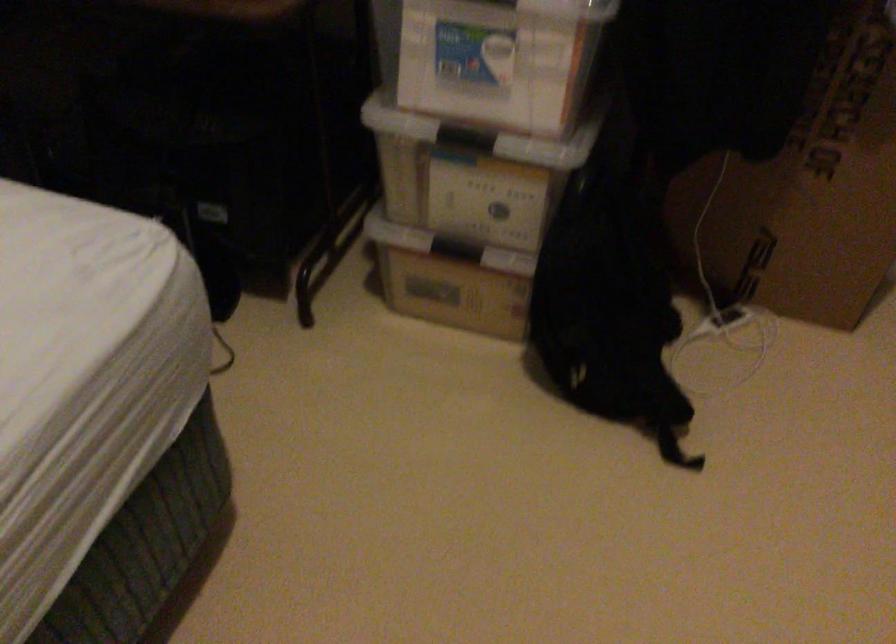
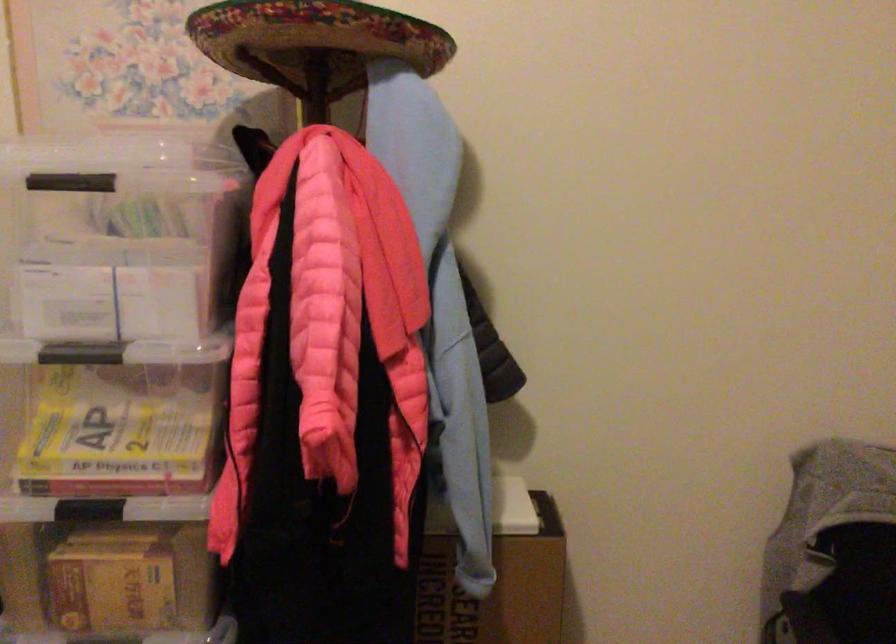
Based on the photo, the images are taken continuously from a first-person perspective. In which direction is your viewpoint rotating?

The camera rotated toward right-up.